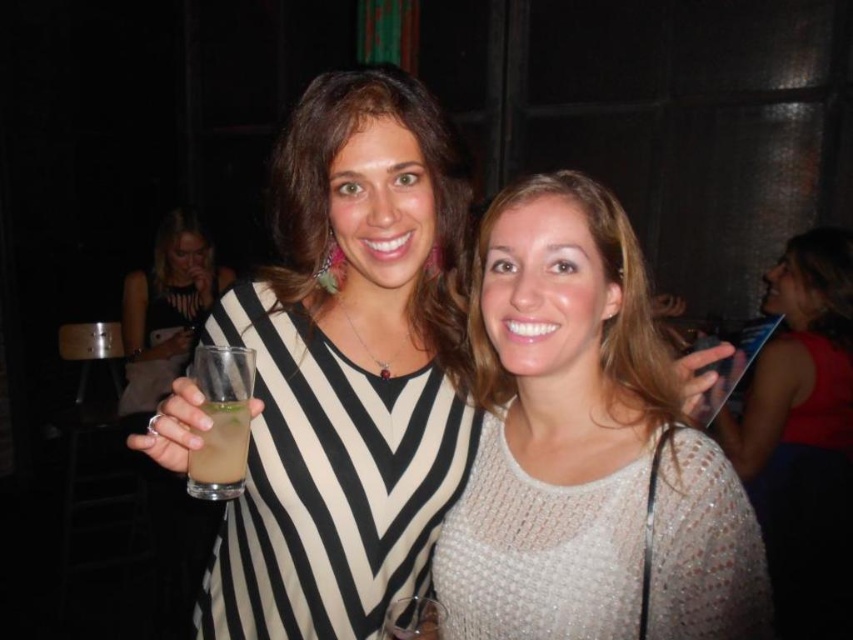
Question: Is the position of white knitted sweater at center less distant than that of clear glass wine glass at center?

Choices:
 (A) yes
 (B) no

Answer: (B)

Question: Which object is positioned farthest from the white knitted sweater at center?

Choices:
 (A) white textured sweater at right
 (B) clear plastic glass at left
 (C) clear glass wine glass at center
 (D) clear plastic cup at center

Answer: (D)

Question: Which object is farther from the camera taking this photo?

Choices:
 (A) white knitted sweater at center
 (B) clear plastic cup at center

Answer: (B)

Question: Is black and white striped dress at center to the left of clear plastic glass at left from the viewer's perspective?

Choices:
 (A) no
 (B) yes

Answer: (A)

Question: Can you confirm if white knitted sweater at center is wider than clear glass wine glass at center?

Choices:
 (A) no
 (B) yes

Answer: (B)

Question: Based on their relative distances, which object is nearer to the white textured sweater at right?

Choices:
 (A) black and white striped dress at center
 (B) clear plastic glass at left
 (C) clear glass wine glass at center

Answer: (A)